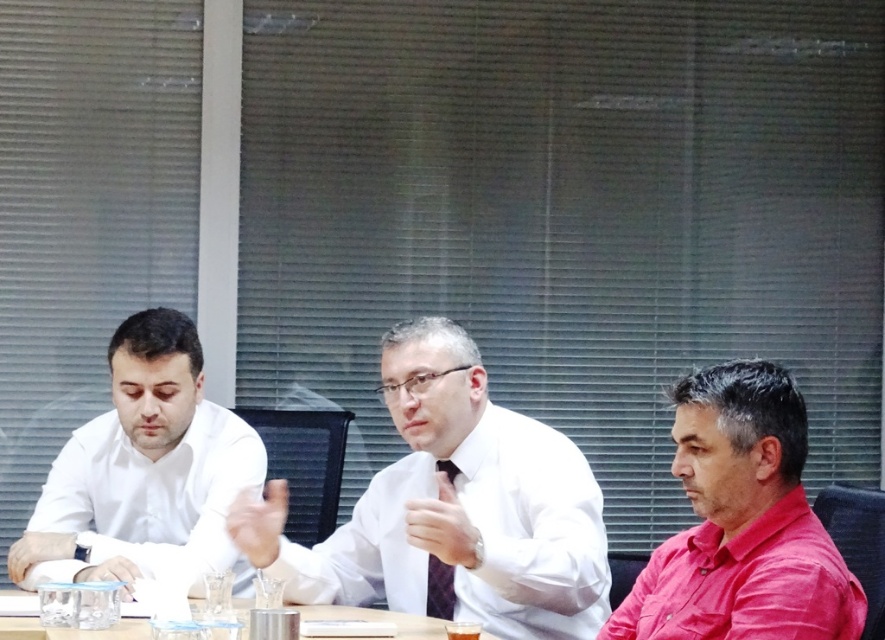
Is matte pink shirt at lower right to the left of plaid fabric tie at center from the viewer's perspective?

In fact, matte pink shirt at lower right is to the right of plaid fabric tie at center.

Looking at this image, which of these two, matte pink shirt at lower right or plaid fabric tie at center, stands shorter?

Standing shorter between the two is plaid fabric tie at center.

What do you see at coordinates (743, 524) in the screenshot? I see `matte pink shirt at lower right` at bounding box center [743, 524].

At what (x,y) coordinates should I click in order to perform the action: click on matte pink shirt at lower right. Please return your answer as a coordinate pair (x, y). Looking at the image, I should click on (743, 524).

Can you confirm if white glossy shirt at left is taller than plaid fabric tie at center?

Correct, white glossy shirt at left is much taller as plaid fabric tie at center.

Who is more distant from viewer, (137, 364) or (447, 612)?

The point (137, 364) is behind.

Which is behind, point (191, 538) or point (451, 580)?

The point (191, 538) is behind.

The height and width of the screenshot is (640, 885). Identify the location of white glossy shirt at left. (143, 470).

Who is more forward, (122, 380) or (291, 609)?

Point (291, 609) is more forward.

In the scene shown: Does white glossy shirt at left appear on the left side of clear plastic cups at center?

Correct, you'll find white glossy shirt at left to the left of clear plastic cups at center.

At what (x,y) coordinates should I click in order to perform the action: click on white glossy shirt at left. Please return your answer as a coordinate pair (x, y). This screenshot has width=885, height=640. Looking at the image, I should click on (143, 470).

Find the location of a particular element. The height and width of the screenshot is (640, 885). white glossy shirt at left is located at coordinates (143, 470).